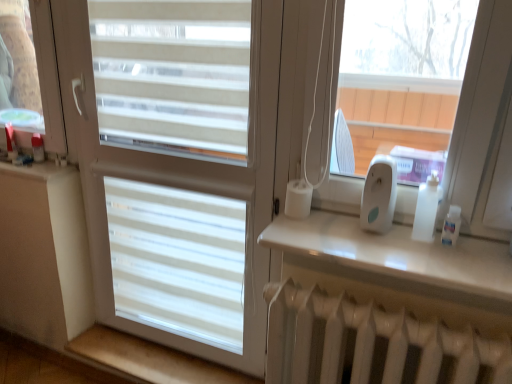
At what (x,y) coordinates should I click in order to perform the action: click on free space above white glossy shelf at upper right, positioned as the second window sill in bottom-to-top order (from a real-world perspective). Please return your answer as a coordinate pair (x, y). Image resolution: width=512 pixels, height=384 pixels. Looking at the image, I should click on (388, 234).